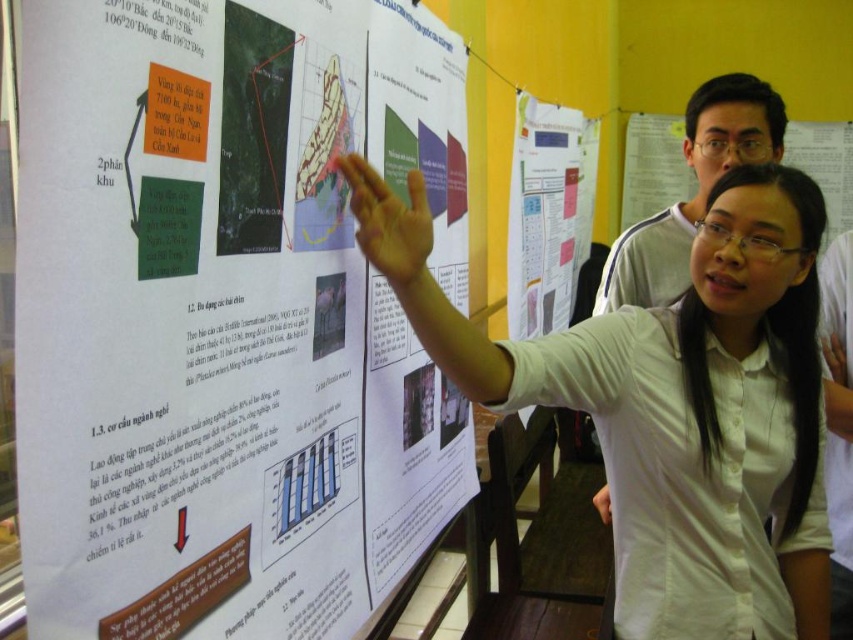
Between white paper poster at center and white shirt at center, which one is positioned lower?

white shirt at center is below.

Can you confirm if white paper poster at center is positioned to the left of white shirt at center?

Yes, white paper poster at center is to the left of white shirt at center.

Does point (141, 372) come in front of point (496, 353)?

Yes, it is in front of point (496, 353).

At what (x,y) coordinates should I click in order to perform the action: click on white paper poster at center. Please return your answer as a coordinate pair (x, y). The image size is (853, 640). Looking at the image, I should click on (225, 316).

Can you confirm if white shirt at center is taller than white paper at center?

In fact, white shirt at center may be shorter than white paper at center.

This screenshot has height=640, width=853. I want to click on white shirt at center, so click(x=726, y=328).

In the scene shown: Which of these two, white paper poster at center or white paper at center, stands shorter?

white paper at center is shorter.

Can you confirm if white paper poster at center is bigger than white paper at center?

Incorrect, white paper poster at center is not larger than white paper at center.

Describe the element at coordinates (225, 316) in the screenshot. The width and height of the screenshot is (853, 640). I see `white paper poster at center` at that location.

Identify the location of white paper poster at center. tap(225, 316).